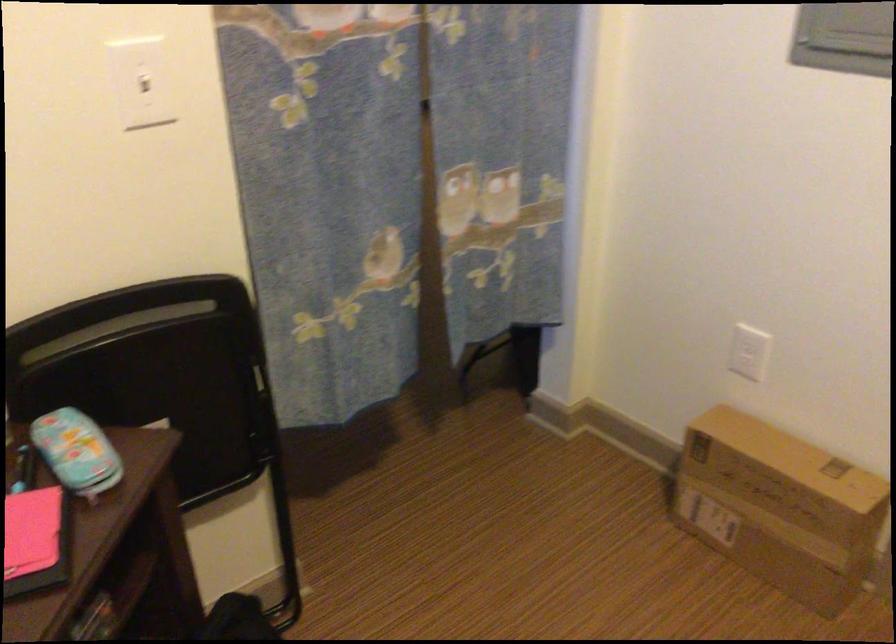
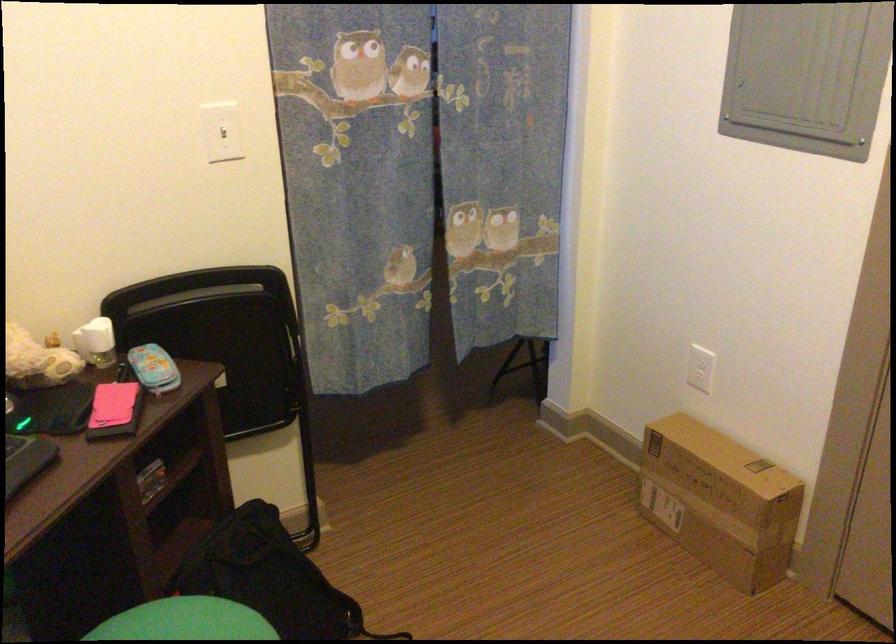
Locate, in the second image, the point that corresponds to (x=91, y=448) in the first image.

(153, 368)